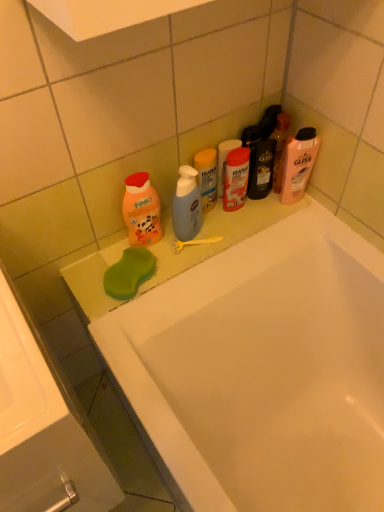
Question: Is pink matte shampoo at upper right, marked as the 3th cleaning product in a left-to-right arrangement, in contact with white glossy sink at lower left?

Choices:
 (A) yes
 (B) no

Answer: (B)

Question: From the image's perspective, is pink matte shampoo at upper right, marked as the 3th cleaning product in a left-to-right arrangement, over white glossy sink at lower left?

Choices:
 (A) yes
 (B) no

Answer: (A)

Question: Is pink matte shampoo at upper right, marked as the 3th cleaning product in a left-to-right arrangement, not inside white glossy sink at lower left?

Choices:
 (A) no
 (B) yes

Answer: (B)

Question: Does pink matte shampoo at upper right, the 1th cleaning product positioned from the right, come behind white glossy sink at lower left?

Choices:
 (A) no
 (B) yes

Answer: (B)

Question: Can you confirm if pink matte shampoo at upper right, the 1th cleaning product positioned from the right, is positioned to the left of white glossy sink at lower left?

Choices:
 (A) no
 (B) yes

Answer: (A)

Question: Can you confirm if white glossy sink at lower left is taller than white glossy bathtub at upper center?

Choices:
 (A) yes
 (B) no

Answer: (B)

Question: From the image's perspective, is white glossy sink at lower left located beneath white glossy bathtub at upper center?

Choices:
 (A) yes
 (B) no

Answer: (B)

Question: Does white glossy sink at lower left have a smaller size compared to white glossy bathtub at upper center?

Choices:
 (A) no
 (B) yes

Answer: (B)

Question: From the image's perspective, is white glossy sink at lower left located above white glossy bathtub at upper center?

Choices:
 (A) no
 (B) yes

Answer: (B)

Question: Is the position of white glossy sink at lower left less distant than that of white glossy bathtub at upper center?

Choices:
 (A) yes
 (B) no

Answer: (A)

Question: From a real-world perspective, is white glossy sink at lower left physically above white glossy bathtub at upper center?

Choices:
 (A) yes
 (B) no

Answer: (A)

Question: Can you confirm if orange matte baby soap at left, which is the first cleaning product in left-to-right order, is bigger than white glossy sink at lower left?

Choices:
 (A) no
 (B) yes

Answer: (A)